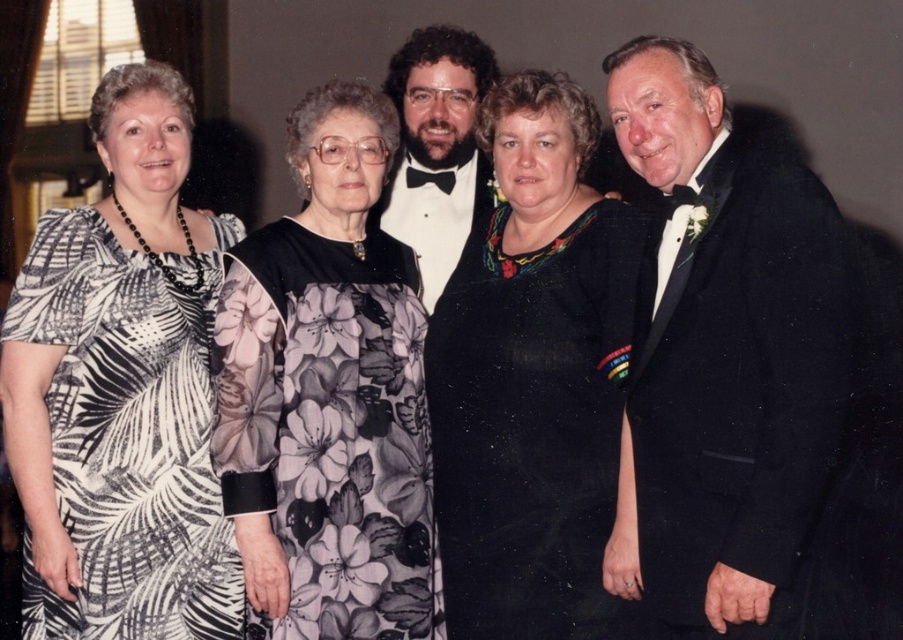
Question: Estimate the real-world distances between objects in this image. Which object is farther from the black satin tuxedo at center?

Choices:
 (A) black matte dress at center
 (B) floral-patterned dress at center

Answer: (B)

Question: Is printed fabric dress at left bigger than black satin tuxedo at center?

Choices:
 (A) no
 (B) yes

Answer: (B)

Question: Which point is farther from the camera taking this photo?

Choices:
 (A) (462, 317)
 (B) (99, 401)
 (C) (398, 84)
 (D) (710, 504)

Answer: (C)

Question: Can you confirm if black wool suit at right is positioned to the right of black matte dress at center?

Choices:
 (A) no
 (B) yes

Answer: (B)

Question: Which point is closer to the camera?

Choices:
 (A) (98, 541)
 (B) (505, 108)

Answer: (A)

Question: Is floral-patterned dress at center below black satin tuxedo at center?

Choices:
 (A) no
 (B) yes

Answer: (B)